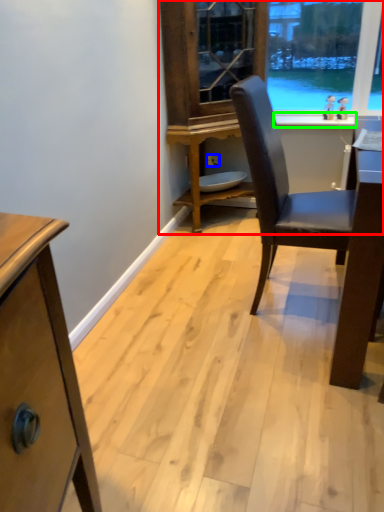
Question: Which object is the farthest from dresser (highlighted by a red box)? Choose among these: power outlet (highlighted by a blue box) or window sill (highlighted by a green box).

Choices:
 (A) power outlet
 (B) window sill

Answer: (A)